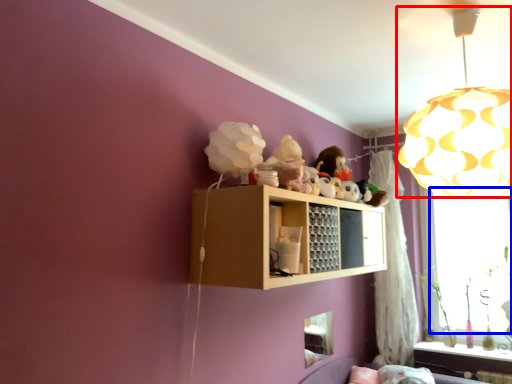
Question: Which of the following is the farthest to the observer, lamp (highlighted by a red box) or window screen (highlighted by a blue box)?

Choices:
 (A) lamp
 (B) window screen

Answer: (B)